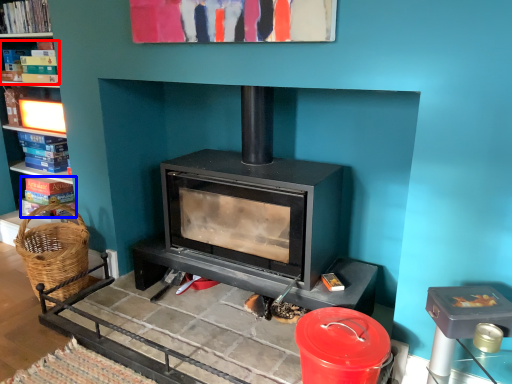
Question: Which of the following is the closest to the observer, book (highlighted by a red box) or book (highlighted by a blue box)?

Choices:
 (A) book
 (B) book

Answer: (A)